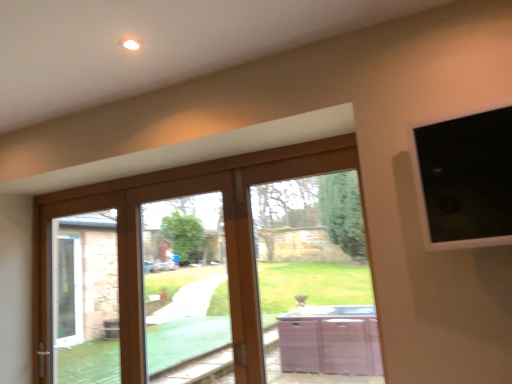
Question: Does clear glass door at center come in front of black glass at upper right?

Choices:
 (A) no
 (B) yes

Answer: (A)

Question: Is clear glass door at center aimed at black glass at upper right?

Choices:
 (A) yes
 (B) no

Answer: (B)

Question: Does clear glass door at center have a greater width compared to black glass at upper right?

Choices:
 (A) no
 (B) yes

Answer: (A)

Question: Would you say clear glass door at center is a long distance from black glass at upper right?

Choices:
 (A) no
 (B) yes

Answer: (B)

Question: Is clear glass door at center bigger than black glass at upper right?

Choices:
 (A) no
 (B) yes

Answer: (B)

Question: Considering the positions of brown wooden bay window at center and wooden glass door at center in the image, is brown wooden bay window at center taller or shorter than wooden glass door at center?

Choices:
 (A) short
 (B) tall

Answer: (B)

Question: From the image's perspective, is brown wooden bay window at center positioned above or below wooden glass door at center?

Choices:
 (A) below
 (B) above

Answer: (B)

Question: Relative to wooden glass door at center, is brown wooden bay window at center in front or behind?

Choices:
 (A) front
 (B) behind

Answer: (B)

Question: Considering the positions of brown wooden bay window at center and wooden glass door at center in the image, is brown wooden bay window at center wider or thinner than wooden glass door at center?

Choices:
 (A) wide
 (B) thin

Answer: (B)

Question: Based on their positions, is clear glass door at center located to the left or right of brown wooden bay window at center?

Choices:
 (A) right
 (B) left

Answer: (B)

Question: From the image's perspective, is clear glass door at center located above or below brown wooden bay window at center?

Choices:
 (A) above
 (B) below

Answer: (B)

Question: In terms of height, does clear glass door at center look taller or shorter compared to brown wooden bay window at center?

Choices:
 (A) tall
 (B) short

Answer: (A)

Question: Considering their positions, is clear glass door at center located in front of or behind brown wooden bay window at center?

Choices:
 (A) behind
 (B) front

Answer: (A)

Question: From a real-world perspective, relative to wooden glass door at center, is clear glass door at center vertically above or below?

Choices:
 (A) above
 (B) below

Answer: (A)

Question: Is point (155, 327) closer or farther from the camera than point (94, 279)?

Choices:
 (A) closer
 (B) farther

Answer: (A)